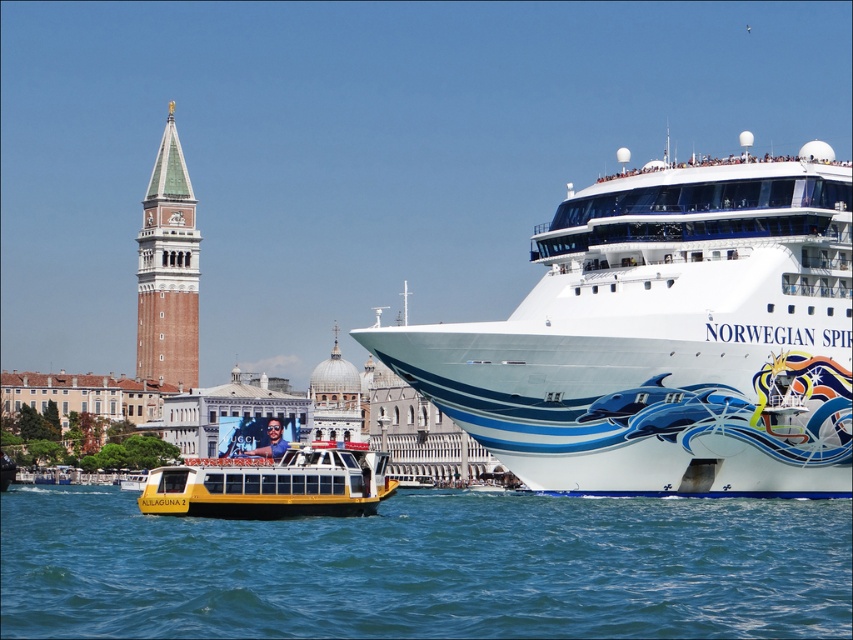
You are a tourist standing on the left side of the waterway. You see the blue water at lower left and the brick stonework bell tower at upper left. Which object takes up more space in your view?

The blue water at lower left takes up more space in your view because it has a larger size compared to the brick stonework bell tower at upper left.

You are a photographer standing on the deck of the white glossy cruise ship at right. You want to take a photo of the brick stonework bell tower at upper left. Will the tower be fully visible in your photo if you point your camera straight ahead?

The white glossy cruise ship at right is taller than the brick stonework bell tower at upper left. Since you are on the deck of the cruise ship, which is taller than the tower, pointing the camera straight ahead might not capture the entire tower. You might need to angle the camera downward to ensure the tower is fully visible in the photo.

You are a tourist standing on the bridge in the scene, looking towards the blue water at lower left and the brick stonework bell tower at upper left. Which object is closer to your eye level? Please explain based on their positions.

The blue water at lower left is closer to your eye level because it is positioned below the brick stonework bell tower at upper left, which is higher up in the scene.